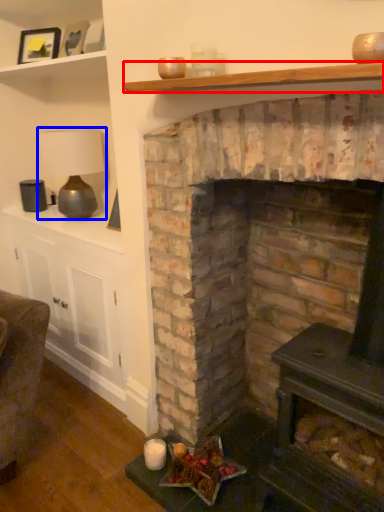
Question: Which point is closer to the camera, shelf (highlighted by a red box) or lamp (highlighted by a blue box)?

Choices:
 (A) shelf
 (B) lamp

Answer: (A)